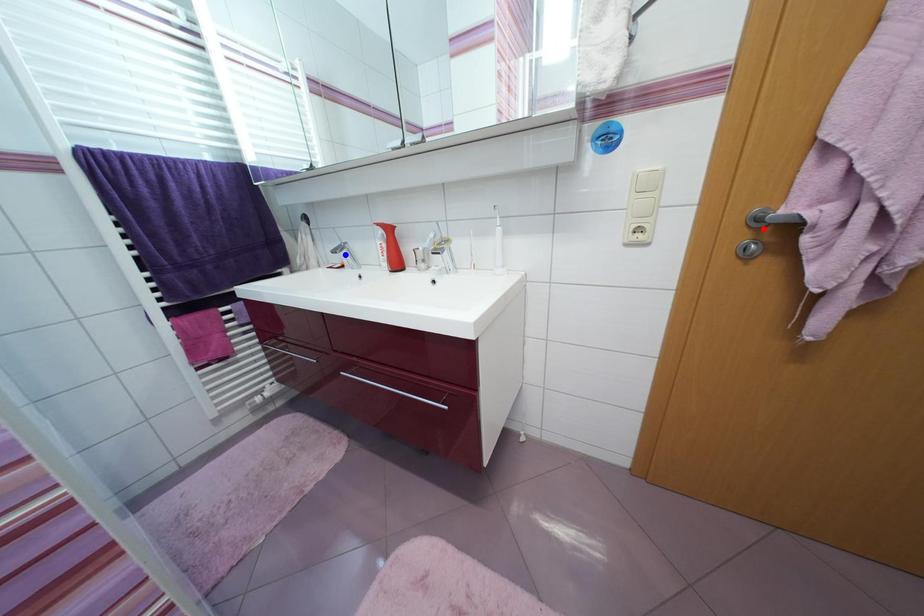
Question: Two points are marked on the image. Which point is closer to the camera?

Choices:
 (A) Blue point is closer.
 (B) Red point is closer.

Answer: (B)